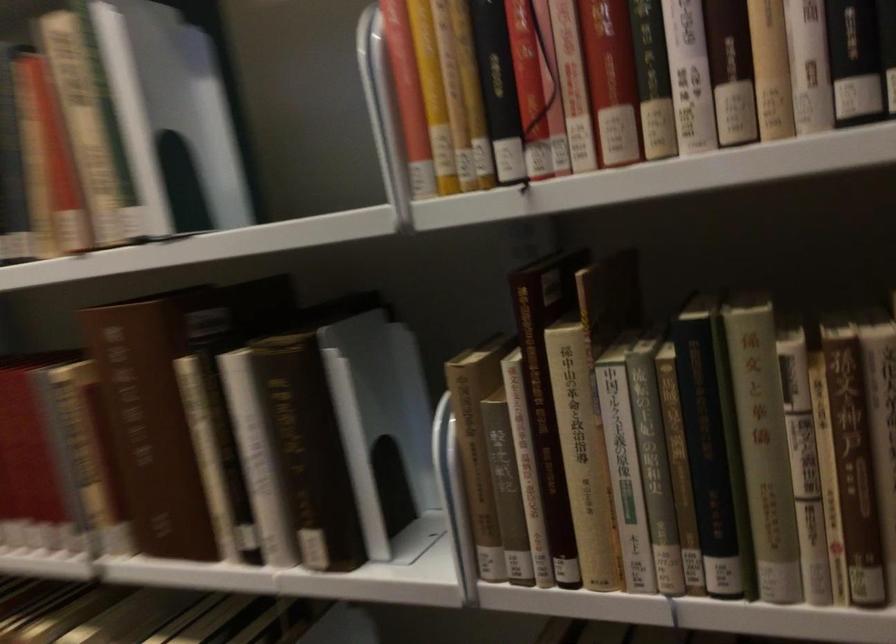
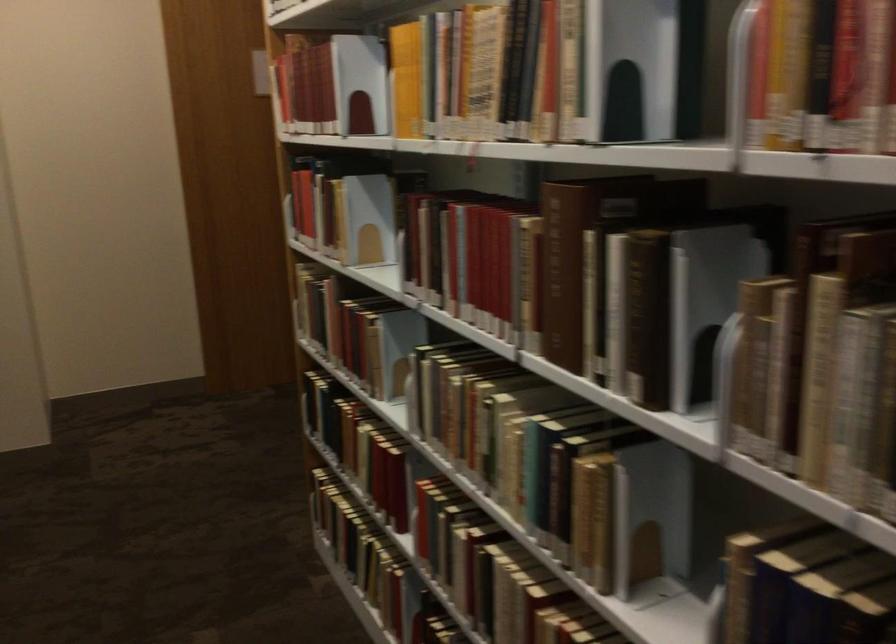
The point at (116, 480) is marked in the first image. Where is the corresponding point in the second image?

(540, 299)